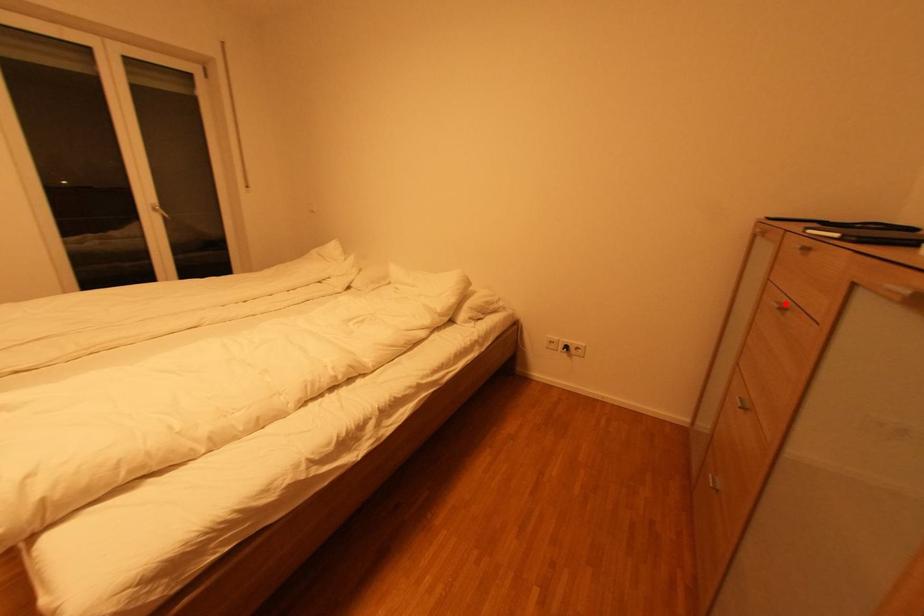
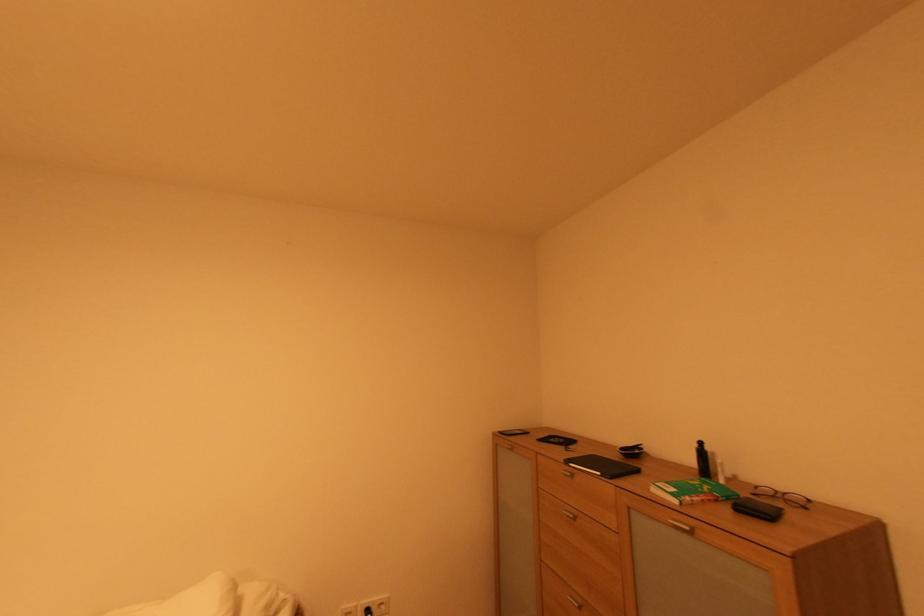
Question: I am providing you with two images of the same scene from different viewpoints. A red point is shown in image1. For the corresponding object point in image2, is it positioned nearer or farther from the camera?

Choices:
 (A) Nearer
 (B) Farther

Answer: (B)